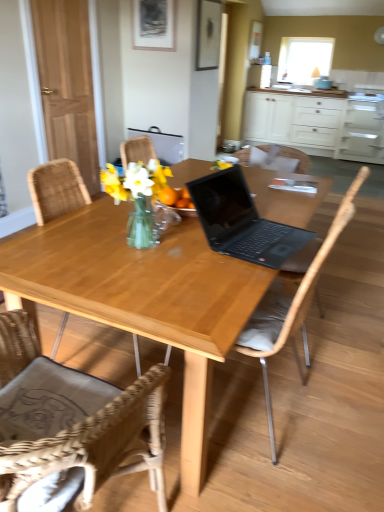
Question: Is wooden chair at center, the second chair in the front-to-back sequence, next to transparent glass window screen at upper center?

Choices:
 (A) no
 (B) yes

Answer: (A)

Question: Is transparent glass window screen at upper center a part of wooden chair at center, which is counted as the 2th chair, starting from the back?

Choices:
 (A) yes
 (B) no

Answer: (B)

Question: Does wooden chair at center, the second chair in the front-to-back sequence, have a greater height compared to transparent glass window screen at upper center?

Choices:
 (A) yes
 (B) no

Answer: (A)

Question: Considering the relative positions of wooden chair at center, which is counted as the 2th chair, starting from the back, and transparent glass window screen at upper center in the image provided, is wooden chair at center, which is counted as the 2th chair, starting from the back, to the left of transparent glass window screen at upper center from the viewer's perspective?

Choices:
 (A) no
 (B) yes

Answer: (B)

Question: Does wooden chair at center, the second chair in the front-to-back sequence, have a greater width compared to transparent glass window screen at upper center?

Choices:
 (A) yes
 (B) no

Answer: (A)

Question: Is wooden picture frame at upper center, acting as the 1th picture frame starting from the right, spatially inside wooden chair at center, the second chair in the front-to-back sequence, or outside of it?

Choices:
 (A) inside
 (B) outside

Answer: (B)

Question: Is wooden picture frame at upper center, placed as the 2th picture frame when sorted from left to right, bigger or smaller than wooden chair at center, the second chair in the front-to-back sequence?

Choices:
 (A) small
 (B) big

Answer: (A)

Question: Is wooden picture frame at upper center, acting as the 1th picture frame starting from the right, taller or shorter than wooden chair at center, which is counted as the 2th chair, starting from the back?

Choices:
 (A) tall
 (B) short

Answer: (B)

Question: Looking at their shapes, would you say wooden picture frame at upper center, placed as the 2th picture frame when sorted from left to right, is wider or thinner than wooden chair at center, the second chair in the front-to-back sequence?

Choices:
 (A) thin
 (B) wide

Answer: (A)

Question: Based on their positions, is wooden picture frame at upper center, acting as the 1th picture frame starting from the right, located to the left or right of white matte cabinet at upper right?

Choices:
 (A) left
 (B) right

Answer: (A)

Question: Considering the positions of wooden picture frame at upper center, acting as the 1th picture frame starting from the right, and white matte cabinet at upper right in the image, is wooden picture frame at upper center, acting as the 1th picture frame starting from the right, bigger or smaller than white matte cabinet at upper right?

Choices:
 (A) small
 (B) big

Answer: (A)

Question: From a real-world perspective, is wooden picture frame at upper center, placed as the 2th picture frame when sorted from left to right, above or below white matte cabinet at upper right?

Choices:
 (A) below
 (B) above

Answer: (B)

Question: Relative to white matte cabinet at upper right, is wooden picture frame at upper center, acting as the 1th picture frame starting from the right, in front or behind?

Choices:
 (A) front
 (B) behind

Answer: (A)

Question: From the image's perspective, is wooden chair at center, which is the third chair from front to back, located above or below white matte cabinet at upper right?

Choices:
 (A) above
 (B) below

Answer: (B)

Question: Looking at the image, does wooden chair at center, which is the first chair in back-to-front order, seem bigger or smaller compared to white matte cabinet at upper right?

Choices:
 (A) small
 (B) big

Answer: (A)